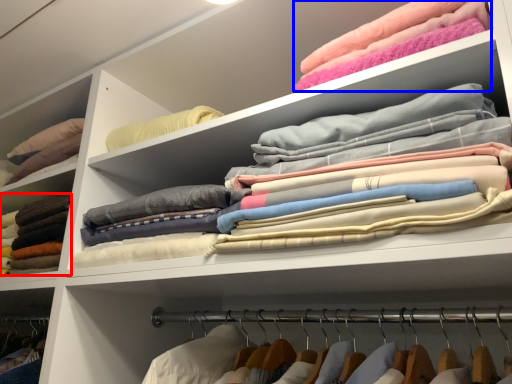
Question: Among these objects, which one is farthest to the camera, clothing (highlighted by a red box) or clothing (highlighted by a blue box)?

Choices:
 (A) clothing
 (B) clothing

Answer: (A)